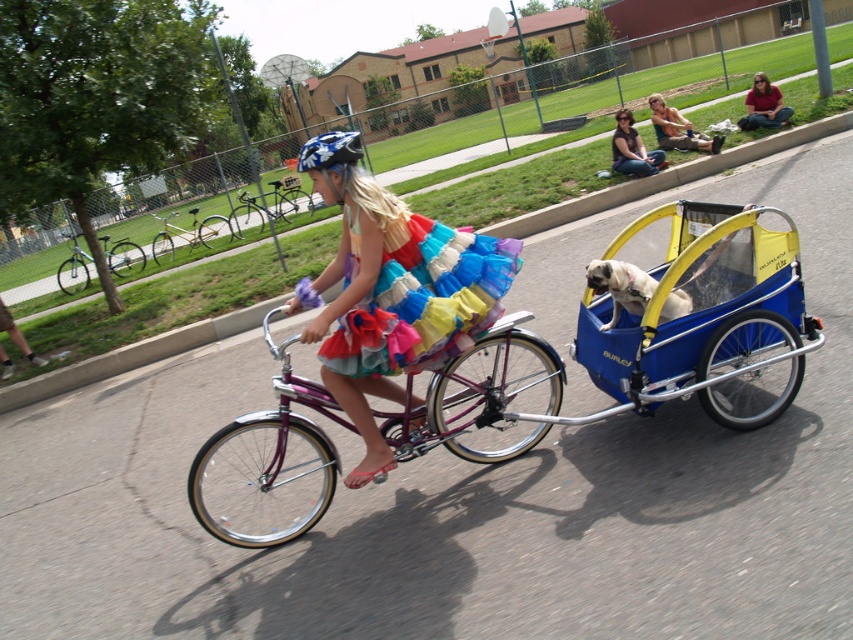
You are a GUI agent. You are given a task and a screenshot of the screen. Output one action in this format:
    pyautogui.click(x=<x>, y=<y>)
    Task: Click on the denim shorts at lower right
    The width and height of the screenshot is (853, 640).
    Given the screenshot: What is the action you would take?
    [677, 129]

Where is `denim shorts at lower right`? This screenshot has width=853, height=640. denim shorts at lower right is located at coordinates (677, 129).

From the picture: Can you confirm if black matte bicycle at center is bigger than matte red shirt at upper right?

Yes, black matte bicycle at center is bigger than matte red shirt at upper right.

Which is above, black matte bicycle at center or matte red shirt at upper right?

Positioned higher is matte red shirt at upper right.

Who is more forward, (270, 192) or (764, 86)?

Point (764, 86) is in front.

Locate an element on the screen. This screenshot has width=853, height=640. black matte bicycle at center is located at coordinates (262, 209).

Which is behind, point (431, 301) or point (505, 400)?

The point (505, 400) is more distant.

Who is shorter, multicolored tulle skirt at center or shiny purple bicycle at center?

With less height is shiny purple bicycle at center.

Locate an element on the screen. Image resolution: width=853 pixels, height=640 pixels. multicolored tulle skirt at center is located at coordinates (396, 300).

Where is `multicolored tulle skirt at center`? This screenshot has height=640, width=853. multicolored tulle skirt at center is located at coordinates (396, 300).